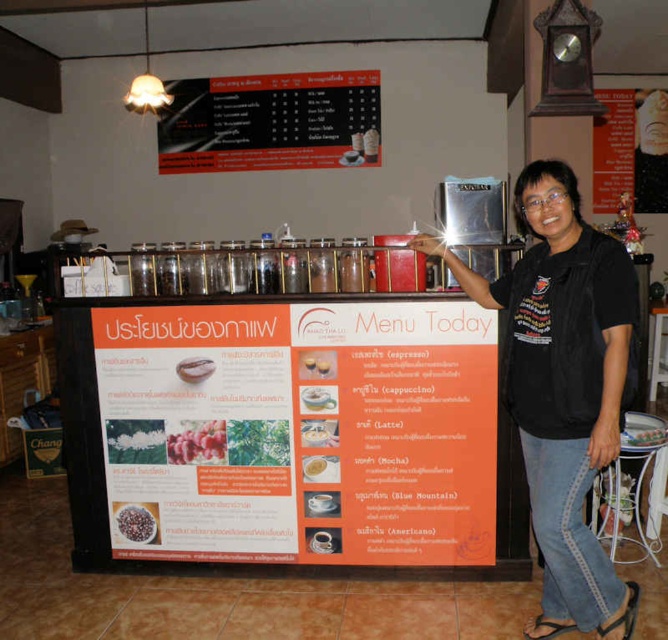
Question: Is red matte coffee beans at center further to camera compared to white matte coffee cup at center?

Choices:
 (A) yes
 (B) no

Answer: (A)

Question: Which point is closer to the camera?

Choices:
 (A) (321, 472)
 (B) (200, 428)

Answer: (A)

Question: Does red matte coffee beans at center have a smaller size compared to white glossy cup at center?

Choices:
 (A) no
 (B) yes

Answer: (A)

Question: Estimate the real-world distances between objects in this image. Which object is farther from the white glossy cup at center?

Choices:
 (A) white creamy latte at center
 (B) orange paper menu at center

Answer: (B)

Question: Which of the following is the farthest from the observer?

Choices:
 (A) (305, 467)
 (B) (305, 362)

Answer: (A)

Question: Does red matte coffee beans at center appear on the left side of brown matte beans at center?

Choices:
 (A) yes
 (B) no

Answer: (B)